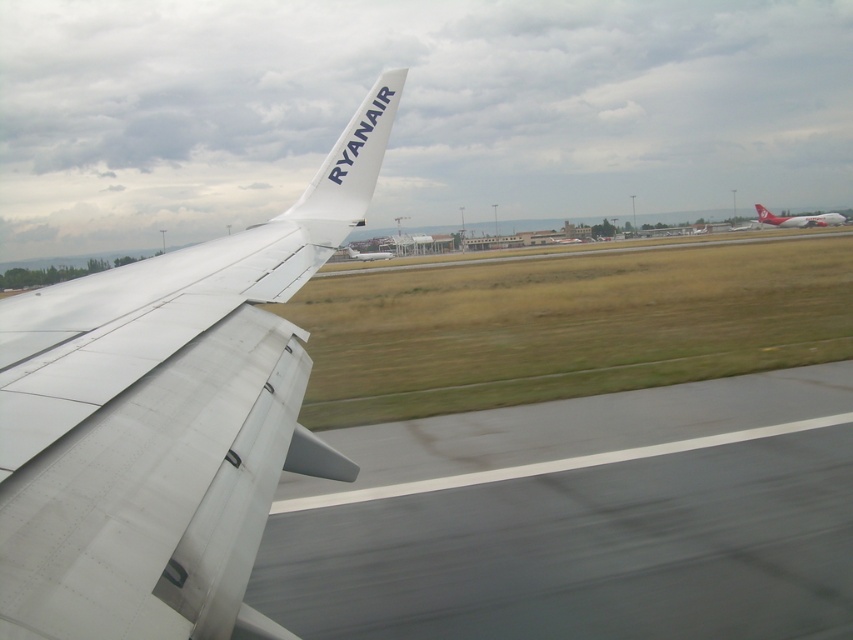
You are a passenger sitting in an airplane seat and looking out the window. You notice a specific point on the wing labeled as point (166, 419). Based on the scene, can you determine what object this point is pointing to?

The point 0.656, 0.196 corresponds to the white matte airplane wing at left.

You are a passenger sitting in the aircraft and looking out the window. You see two points marked on the wing. The first point is at coordinates point (122, 596) and the second is at point (363, 260). From your perspective inside the aircraft, which point is closer to the runway?

Point (122, 596) is in front of point (363, 260), so from your perspective inside the aircraft, point (122, 596) is closer to the runway.